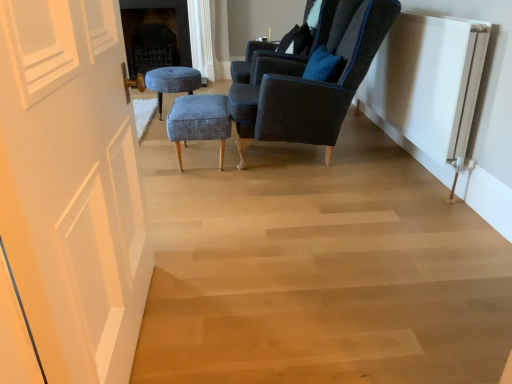
Where is `unoccupied region to the right of blue fabric stool at center, positioned as the 2th stool in back-to-front order`? unoccupied region to the right of blue fabric stool at center, positioned as the 2th stool in back-to-front order is located at coordinates (274, 170).